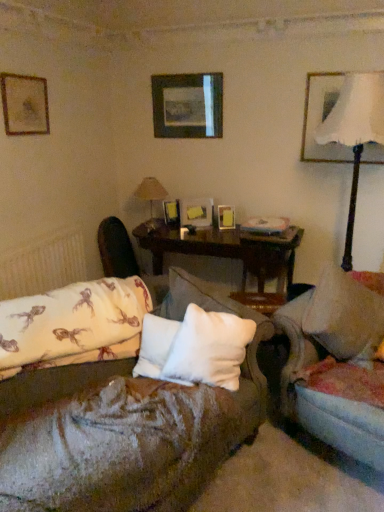
Question: Is wooden picture frame at center, which is counted as the fourth picture frame, starting from the right, inside the boundaries of white soft pillow at center, the first pillow positioned from the right, or outside?

Choices:
 (A) outside
 (B) inside

Answer: (A)

Question: Is wooden picture frame at center, positioned as the 3th picture frame in left-to-right order, to the left or to the right of white soft pillow at center, placed as the 2th pillow when sorted from left to right, in the image?

Choices:
 (A) left
 (B) right

Answer: (A)

Question: Which of these objects is positioned closest to the velvet beige couch at center?

Choices:
 (A) wooden polished table at center
 (B) velvet dark brown swivel chair at center
 (C) matte white picture frame at upper right, which appears as the first picture frame when viewed from the right
 (D) wooden picture frame at center, marked as the fifth picture frame in a left-to-right arrangement
 (E) white textured radiator at lower left

Answer: (A)

Question: Which of these objects is positioned farthest from the velvet dark brown swivel chair at center?

Choices:
 (A) wooden picture frame at center, marked as the fifth picture frame in a left-to-right arrangement
 (B) white textured radiator at lower left
 (C) beige fabric table lamp at center, the first table lamp viewed from the left
 (D) matte white picture frame at upper right, the 6th picture frame in the left-to-right sequence
 (E) velvet beige couch at center

Answer: (E)